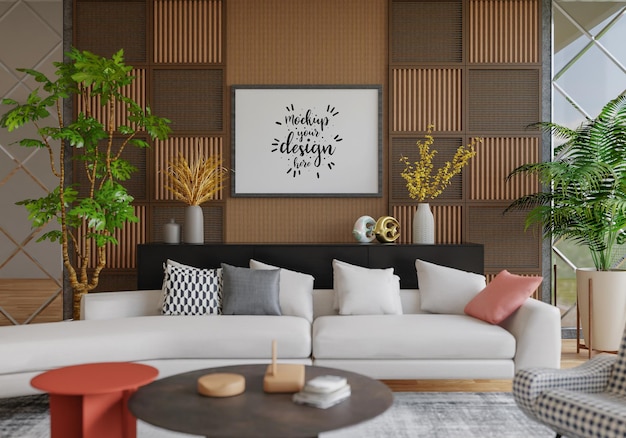
This screenshot has width=626, height=438. What are the coordinates of `green fernlike plant` in the screenshot? It's located at (593, 218).